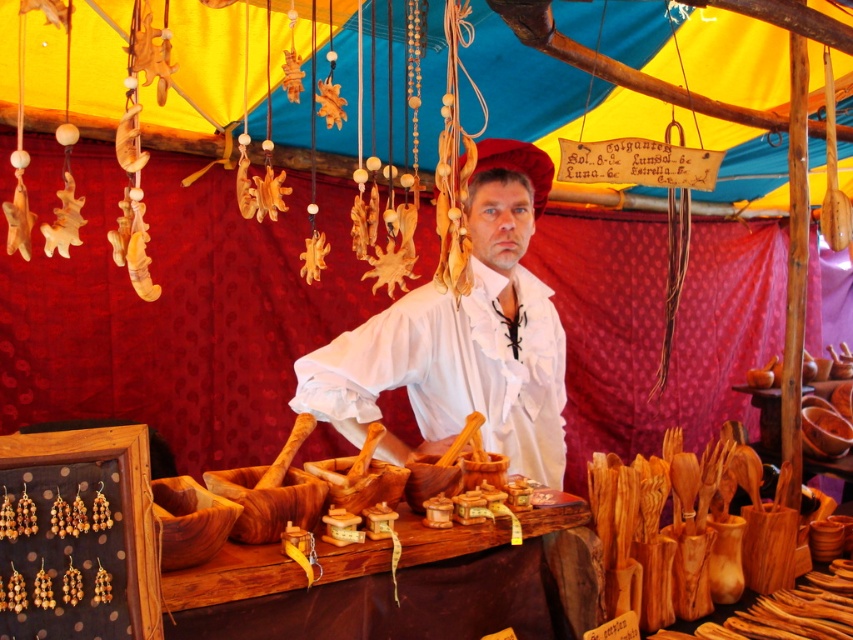
Question: Is white matte shirt at center smaller than wooden at center?

Choices:
 (A) yes
 (B) no

Answer: (B)

Question: Can you confirm if white matte shirt at center is positioned to the right of wooden at center?

Choices:
 (A) no
 (B) yes

Answer: (B)

Question: Which point is farther from the camera taking this photo?

Choices:
 (A) (541, 401)
 (B) (523, 609)

Answer: (A)

Question: Is white matte shirt at center smaller than wooden at center?

Choices:
 (A) yes
 (B) no

Answer: (B)

Question: Which object appears farthest from the camera in this image?

Choices:
 (A) white matte shirt at center
 (B) wooden at center

Answer: (A)